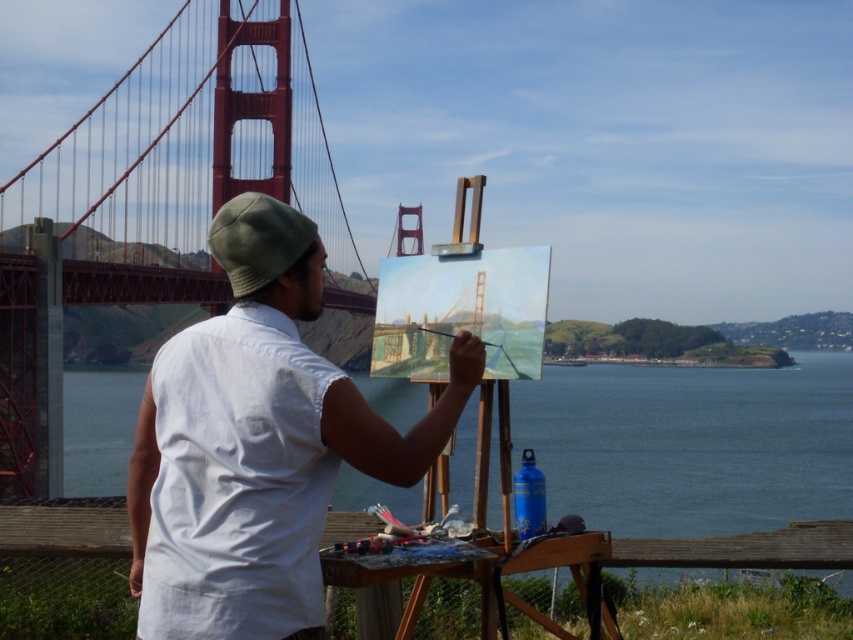
Question: Is blue water at center closer to camera compared to wooden handle paintbrush at center?

Choices:
 (A) yes
 (B) no

Answer: (A)

Question: Is blue water at center behind wooden handle paintbrush at center?

Choices:
 (A) yes
 (B) no

Answer: (B)

Question: Which is farther from the white cotton shirt at center?

Choices:
 (A) blue water at center
 (B) wooden handle paintbrush at center

Answer: (A)

Question: Which point is farther to the camera?

Choices:
 (A) white cotton shirt at center
 (B) blue water at center

Answer: (B)

Question: Which of the following is the closest to the observer?

Choices:
 (A) (653, 374)
 (B) (473, 340)

Answer: (B)

Question: Does white cotton shirt at center appear on the left side of blue water at center?

Choices:
 (A) yes
 (B) no

Answer: (A)